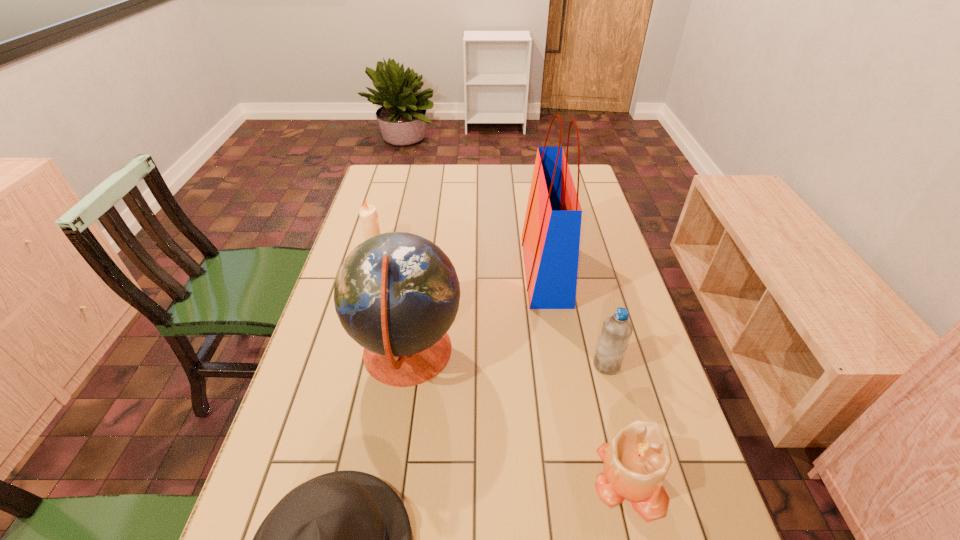
Identify the location of shopping bag. (550, 238).

Identify the location of globe. The image size is (960, 540). (396, 294).

Find the location of a particular element. The image size is (960, 540). water bottle is located at coordinates (616, 331).

The image size is (960, 540). Find the location of `the farther candle`. the farther candle is located at coordinates (368, 214).

Where is `the right candle`? This screenshot has width=960, height=540. the right candle is located at coordinates (636, 461).

You are a GUI agent. You are given a task and a screenshot of the screen. Output one action in this format:
    pyautogui.click(x=<x>, y=<y>)
    Task: Click on the free space located 0.220m on the handle side of the shopping bag
    The height and width of the screenshot is (540, 960).
    Given the screenshot: What is the action you would take?
    pyautogui.click(x=452, y=271)

Where is `free spot located on the handle side of the shopping bag`? The image size is (960, 540). free spot located on the handle side of the shopping bag is located at coordinates [455, 271].

Identify the location of vacant space located on the handle side of the shopping bag. (468, 271).

Image resolution: width=960 pixels, height=540 pixels. I want to click on free spot located with the Americas facing the viewer on the globe, so click(604, 354).

I want to click on free space located 0.390m on the left of the water bottle, so click(x=436, y=365).